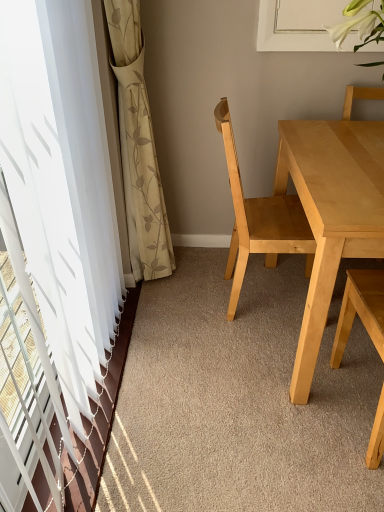
Find the location of a particular element. light wood table at center is located at coordinates (331, 213).

The height and width of the screenshot is (512, 384). Describe the element at coordinates (331, 213) in the screenshot. I see `light wood table at center` at that location.

In order to click on beige floral fabric curtain at left in this screenshot , I will do `click(138, 147)`.

This screenshot has height=512, width=384. What are the coordinates of `light wood chair at right, the first chair viewed from the right` in the screenshot? It's located at (361, 311).

This screenshot has height=512, width=384. What do you see at coordinates (361, 311) in the screenshot?
I see `light wood chair at right, the first chair viewed from the right` at bounding box center [361, 311].

Where is `light wood chair at center, the first chair in the left-to-right sequence`? This screenshot has width=384, height=512. light wood chair at center, the first chair in the left-to-right sequence is located at coordinates (259, 220).

Can we say beige floral fabric curtain at left lies outside light wood table at center?

That's correct, beige floral fabric curtain at left is outside of light wood table at center.

Which of these two, beige floral fabric curtain at left or light wood table at center, is smaller?

beige floral fabric curtain at left.

From a real-world perspective, is beige floral fabric curtain at left positioned under light wood table at center based on gravity?

Incorrect, from a real-world perspective, beige floral fabric curtain at left is higher than light wood table at center.

Where is `kitchen & dining room table lying below the beige floral fabric curtain at left (from the image's perspective)`? The width and height of the screenshot is (384, 512). kitchen & dining room table lying below the beige floral fabric curtain at left (from the image's perspective) is located at coordinates (331, 213).

Are light wood chair at center, the 2th chair in the right-to-left sequence, and light wood table at center beside each other?

No, light wood chair at center, the 2th chair in the right-to-left sequence, is not with light wood table at center.

This screenshot has width=384, height=512. What are the coordinates of `kitchen & dining room table below the light wood chair at center, the 2th chair in the right-to-left sequence (from the image's perspective)` in the screenshot? It's located at (331, 213).

From the image's perspective, does light wood chair at center, the first chair in the left-to-right sequence, appear higher than light wood table at center?

Yes, from the image's perspective, light wood chair at center, the first chair in the left-to-right sequence, is on top of light wood table at center.

Which object is positioned more to the left, light wood chair at center, the first chair in the left-to-right sequence, or light wood table at center?

Positioned to the left is light wood chair at center, the first chair in the left-to-right sequence.

Is light wood chair at right, the 2th chair viewed from the left, further to camera compared to beige floral fabric curtain at left?

No, the depth of light wood chair at right, the 2th chair viewed from the left, is less than that of beige floral fabric curtain at left.

Consider the image. Considering the sizes of objects light wood chair at right, the first chair viewed from the right, and beige floral fabric curtain at left in the image provided, who is shorter, light wood chair at right, the first chair viewed from the right, or beige floral fabric curtain at left?

light wood chair at right, the first chair viewed from the right, is shorter.

Does light wood chair at right, the 2th chair viewed from the left, turn towards beige floral fabric curtain at left?

No.

Is light wood chair at right, the 2th chair viewed from the left, at the right side of beige floral fabric curtain at left?

Indeed, light wood chair at right, the 2th chair viewed from the left, is positioned on the right side of beige floral fabric curtain at left.

Does beige floral fabric curtain at left appear on the left side of light wood chair at center, the 2th chair in the right-to-left sequence?

Correct, you'll find beige floral fabric curtain at left to the left of light wood chair at center, the 2th chair in the right-to-left sequence.

Is light wood chair at center, the first chair in the left-to-right sequence, at the back of beige floral fabric curtain at left?

Yes, beige floral fabric curtain at left is facing away from light wood chair at center, the first chair in the left-to-right sequence.

Is beige floral fabric curtain at left surrounding light wood chair at center, the 2th chair in the right-to-left sequence?

Definitely not — light wood chair at center, the 2th chair in the right-to-left sequence, is not inside beige floral fabric curtain at left.

Is beige floral fabric curtain at left smaller than light wood chair at center, the first chair in the left-to-right sequence?

Correct, beige floral fabric curtain at left occupies less space than light wood chair at center, the first chair in the left-to-right sequence.

How different are the orientations of light wood chair at right, the first chair viewed from the right, and light wood table at center in degrees?

The angle between the facing direction of light wood chair at right, the first chair viewed from the right, and the facing direction of light wood table at center is 178 degrees.

Is light wood chair at right, the 2th chair viewed from the left, positioned behind light wood table at center?

No, light wood chair at right, the 2th chair viewed from the left, is in front of light wood table at center.

Which of these two, light wood chair at right, the first chair viewed from the right, or light wood table at center, stands shorter?

light wood table at center is shorter.

Is light wood chair at right, the 2th chair viewed from the left, aimed at light wood table at center?

Yes, light wood chair at right, the 2th chair viewed from the left, is turned towards light wood table at center.

Considering the positions of objects light wood table at center and beige floral fabric curtain at left in the image provided, who is more to the left, light wood table at center or beige floral fabric curtain at left?

beige floral fabric curtain at left.

Which of these two, light wood table at center or beige floral fabric curtain at left, stands taller?

beige floral fabric curtain at left is taller.

Is light wood table at center facing away from beige floral fabric curtain at left?

That's not correct — light wood table at center is not looking away from beige floral fabric curtain at left.

Would you say light wood table at center is a long distance from beige floral fabric curtain at left?

→ No, there isn't a large distance between light wood table at center and beige floral fabric curtain at left.

Is white sheer curtain at left further to the viewer compared to light wood chair at center, the 2th chair in the right-to-left sequence?

No, it is in front of light wood chair at center, the 2th chair in the right-to-left sequence.

From a real-world perspective, between white sheer curtain at left and light wood chair at center, the first chair in the left-to-right sequence, who is vertically higher?

white sheer curtain at left.

Does point (51, 143) come farther from viewer compared to point (236, 256)?

No, (51, 143) is in front of (236, 256).

Considering the relative sizes of white sheer curtain at left and light wood chair at center, the first chair in the left-to-right sequence, in the image provided, is white sheer curtain at left wider than light wood chair at center, the first chair in the left-to-right sequence,?

Incorrect, the width of white sheer curtain at left does not surpass that of light wood chair at center, the first chair in the left-to-right sequence.

Locate an element on the screen. This screenshot has width=384, height=512. kitchen & dining room table located on the right of beige floral fabric curtain at left is located at coordinates (331, 213).

Identify the location of chair that is the 2nd object to the left of the light wood table at center, starting at the anchor. (259, 220).

From the image, which object appears to be farther from light wood chair at right, the 2th chair viewed from the left, white sheer curtain at left or light wood table at center?

white sheer curtain at left lies further to light wood chair at right, the 2th chair viewed from the left, than the other object.

Estimate the real-world distances between objects in this image. Which object is closer to light wood chair at right, the first chair viewed from the right, beige floral fabric curtain at left or white sheer curtain at left?

white sheer curtain at left.

Which object lies further to the anchor point light wood table at center, light wood chair at center, the 2th chair in the right-to-left sequence, or white sheer curtain at left?

white sheer curtain at left is further to light wood table at center.

When comparing their distances from beige floral fabric curtain at left, does light wood chair at right, the 2th chair viewed from the left, or light wood table at center seem further?

Based on the image, light wood chair at right, the 2th chair viewed from the left, appears to be further to beige floral fabric curtain at left.

When comparing their distances from white sheer curtain at left, does light wood chair at center, the first chair in the left-to-right sequence, or beige floral fabric curtain at left seem further?

Among the two, light wood chair at center, the first chair in the left-to-right sequence, is located further to white sheer curtain at left.

Estimate the real-world distances between objects in this image. Which object is further from light wood table at center, light wood chair at right, the 2th chair viewed from the left, or beige floral fabric curtain at left?

beige floral fabric curtain at left is positioned further to the anchor light wood table at center.

When comparing their distances from light wood table at center, does light wood chair at center, the 2th chair in the right-to-left sequence, or beige floral fabric curtain at left seem further?

beige floral fabric curtain at left is further to light wood table at center.

Looking at this image, when comparing their distances from white sheer curtain at left, does light wood table at center or light wood chair at center, the 2th chair in the right-to-left sequence, seem further?

light wood table at center is further to white sheer curtain at left.

At what (x,y) coordinates should I click in order to perform the action: click on chair situated between white sheer curtain at left and light wood chair at right, the 2th chair viewed from the left, from left to right. Please return your answer as a coordinate pair (x, y). This screenshot has height=512, width=384. Looking at the image, I should click on (259, 220).

I want to click on curtain located between white sheer curtain at left and light wood chair at right, the 2th chair viewed from the left, in the left-right direction, so click(x=138, y=147).

Locate an element on the screen. kitchen & dining room table between light wood chair at right, the first chair viewed from the right, and light wood chair at center, the first chair in the left-to-right sequence, along the z-axis is located at coordinates (331, 213).

Where is `chair located between beige floral fabric curtain at left and light wood chair at right, the 2th chair viewed from the left, in the left-right direction`? This screenshot has height=512, width=384. chair located between beige floral fabric curtain at left and light wood chair at right, the 2th chair viewed from the left, in the left-right direction is located at coordinates (259, 220).